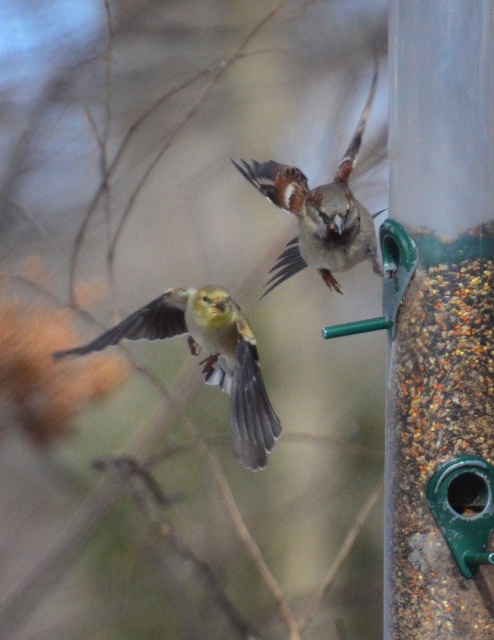
Question: Can you confirm if golden yellow sparrow at left is thinner than brown speckled feathers at center?

Choices:
 (A) no
 (B) yes

Answer: (A)

Question: From the image, what is the correct spatial relationship of golden yellow sparrow at left in relation to brown speckled feathers at center?

Choices:
 (A) left
 (B) right

Answer: (A)

Question: Does golden yellow sparrow at left appear over brown speckled feathers at center?

Choices:
 (A) yes
 (B) no

Answer: (B)

Question: Among these points, which one is farthest from the camera?

Choices:
 (A) (345, 253)
 (B) (272, 444)

Answer: (B)